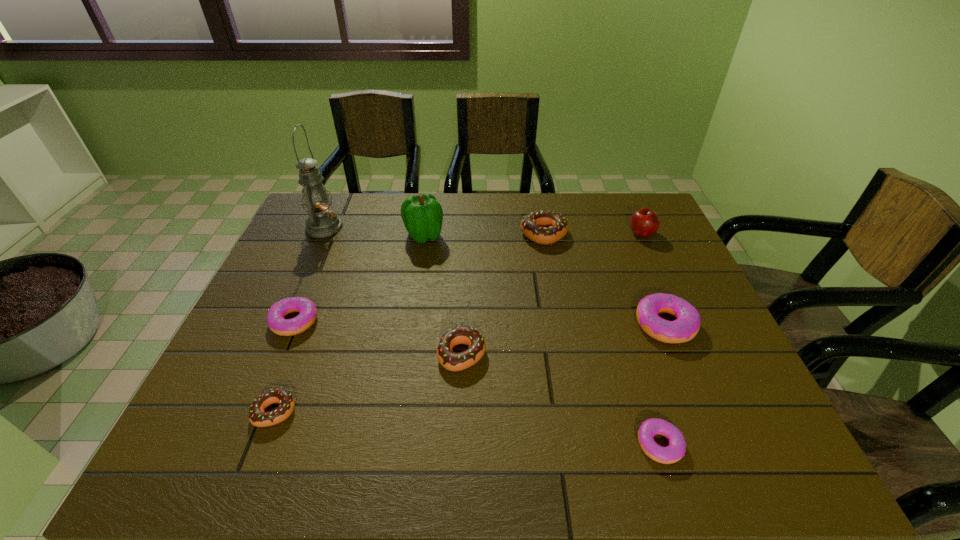
The image size is (960, 540). I want to click on apple present at the right edge, so click(x=644, y=222).

Image resolution: width=960 pixels, height=540 pixels. Find the location of `doughnut located at the right edge`. doughnut located at the right edge is located at coordinates (686, 326).

At what (x,y) coordinates should I click in order to perform the action: click on object that is positioned at the far left corner. Please return your answer as a coordinate pair (x, y). Image resolution: width=960 pixels, height=540 pixels. Looking at the image, I should click on (322, 222).

Identify the location of object located at the near left corner. (257, 416).

Identify the location of object that is positioned at the far right corner. (644, 222).

Identify the location of free space at the far edge of the desktop. Image resolution: width=960 pixels, height=540 pixels. (465, 204).

At what (x,y) coordinates should I click in order to perform the action: click on free region at the right edge of the desktop. Please return your answer as a coordinate pair (x, y). This screenshot has width=960, height=540. Looking at the image, I should click on (647, 244).

Where is `vacant space at the near left corner`? Image resolution: width=960 pixels, height=540 pixels. vacant space at the near left corner is located at coordinates (239, 430).

The height and width of the screenshot is (540, 960). I want to click on vacant space at the far right corner of the desktop, so click(620, 218).

Where is `free location at the near right corner of the desktop`? free location at the near right corner of the desktop is located at coordinates (762, 431).